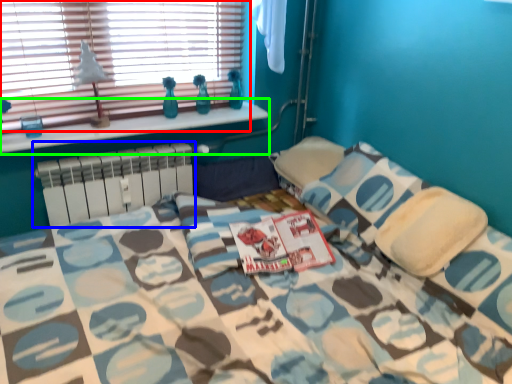
Question: Which object is the closest to the window (highlighted by a red box)? Choose among these: radiator (highlighted by a blue box) or window sill (highlighted by a green box).

Choices:
 (A) radiator
 (B) window sill

Answer: (B)